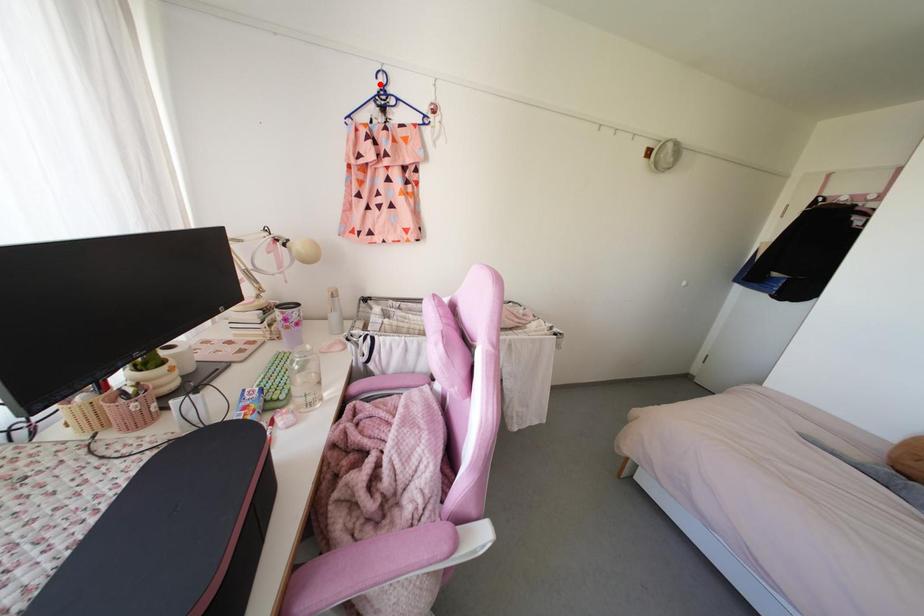
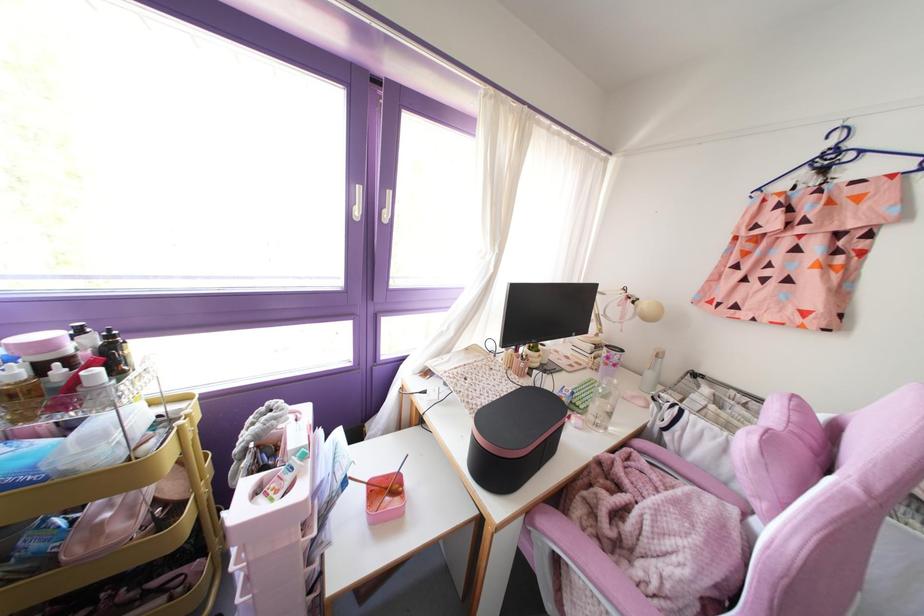
The point at the highlighted location is marked in the first image. Where is the corresponding point in the second image?

(832, 143)